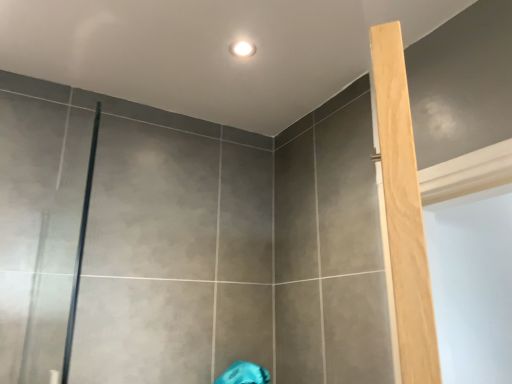
What do you see at coordinates (243, 49) in the screenshot? I see `white glossy light at upper center` at bounding box center [243, 49].

Where is `white glossy light at upper center`? This screenshot has height=384, width=512. white glossy light at upper center is located at coordinates (243, 49).

What is the approximate height of white glossy light at upper center?

0.39 inches.

What is the approximate width of white glossy light at upper center?

white glossy light at upper center is 3.21 inches in width.

At what (x,y) coordinates should I click in order to perform the action: click on white glossy light at upper center. Please return your answer as a coordinate pair (x, y). This screenshot has width=512, height=384. Looking at the image, I should click on (243, 49).